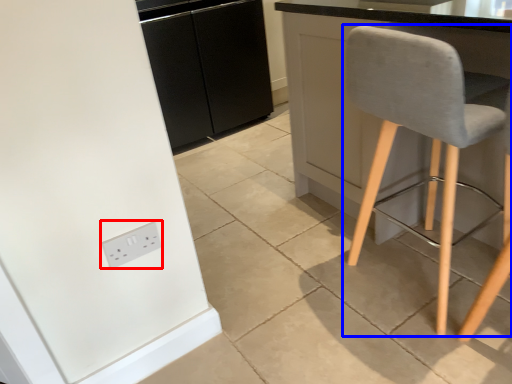
Question: Which object appears farthest to the camera in this image, socket (highlighted by a red box) or chair (highlighted by a blue box)?

Choices:
 (A) socket
 (B) chair

Answer: (A)